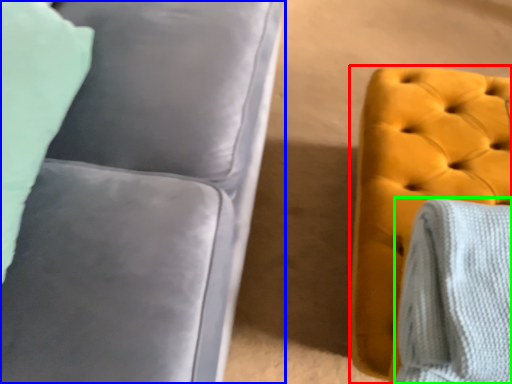
Question: Based on their relative distances, which object is farther from furniture (highlighted by a red box)? Choose from studio couch (highlighted by a blue box) and blanket (highlighted by a green box).

Choices:
 (A) studio couch
 (B) blanket

Answer: (A)